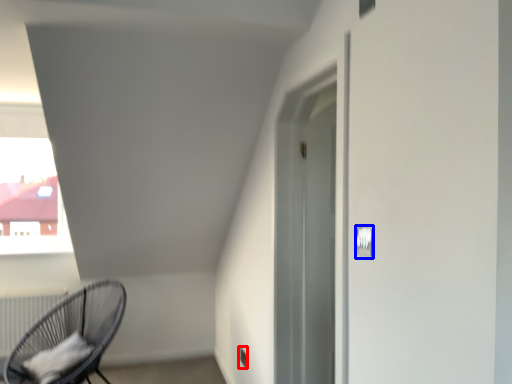
Question: Which object appears closest to the camera in this image, electric outlet (highlighted by a red box) or light switch (highlighted by a blue box)?

Choices:
 (A) electric outlet
 (B) light switch

Answer: (B)